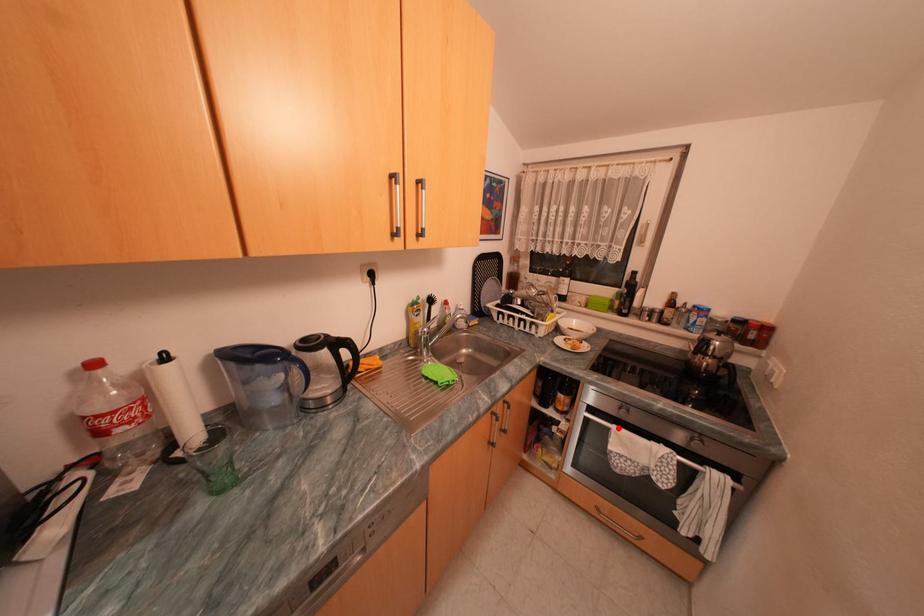
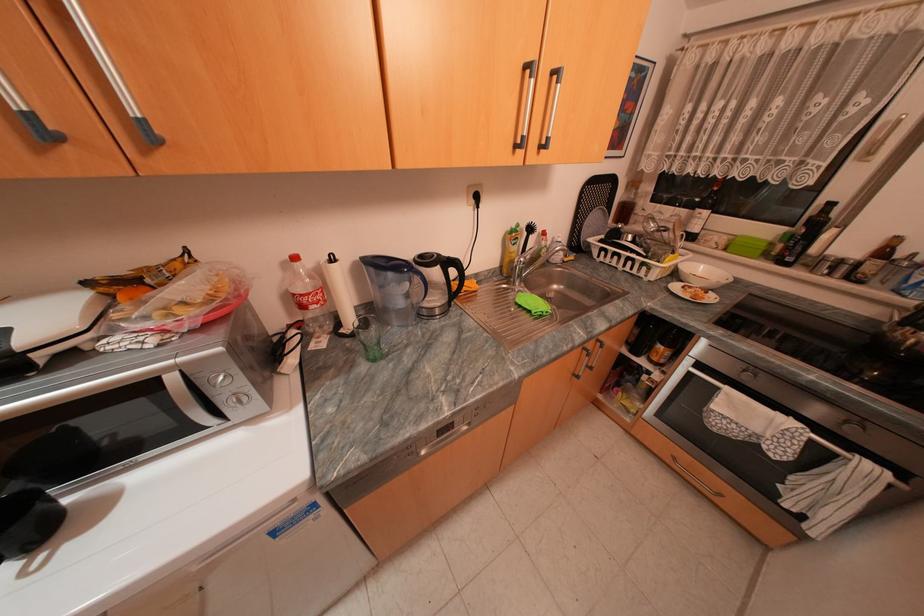
Question: I am providing you with two images of the same scene from different viewpoints. A red point is marked on the first image. Is the red point's position out of view in image 2?

Choices:
 (A) Yes
 (B) No

Answer: (B)